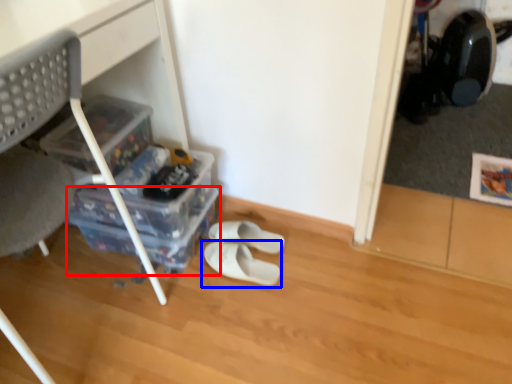
Question: Which object appears farthest to the camera in this image, storage box (highlighted by a red box) or footwear (highlighted by a blue box)?

Choices:
 (A) storage box
 (B) footwear

Answer: (A)